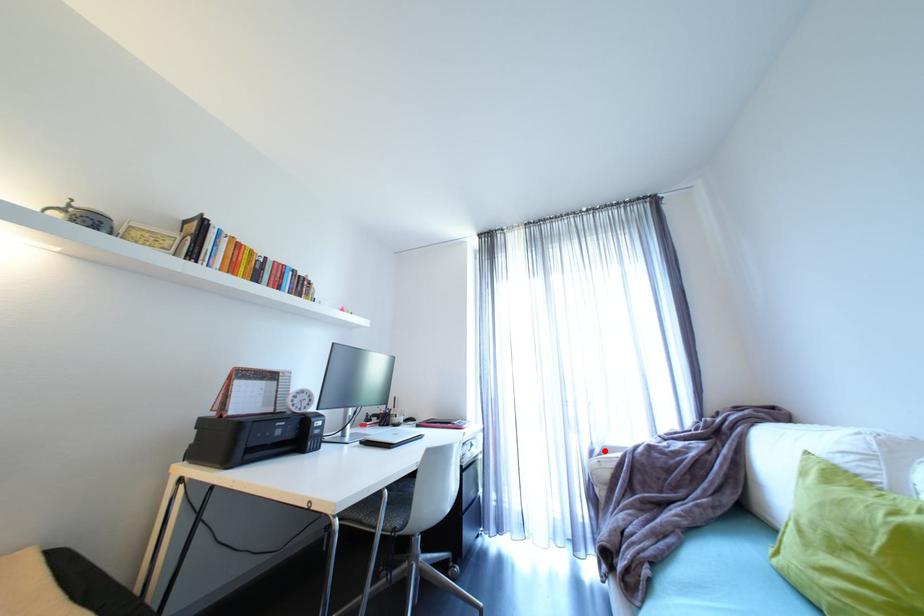
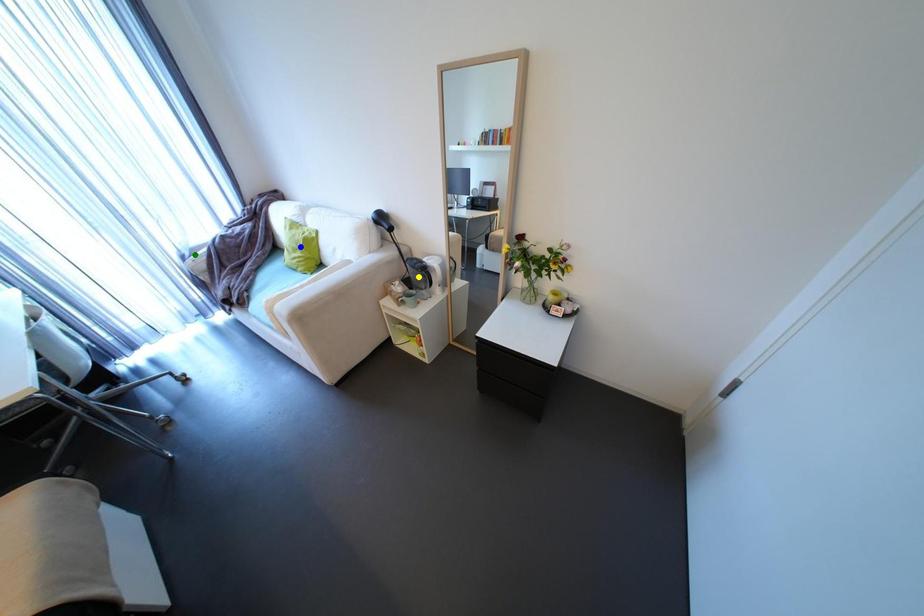
Question: I am providing you with two images of the same scene from different viewpoints. A red point is marked on the first image. You are given multiple points on the second image. Which point in image 2 represents the same 3d spot as the red point in image 1?

Choices:
 (A) green point
 (B) yellow point
 (C) blue point

Answer: (A)